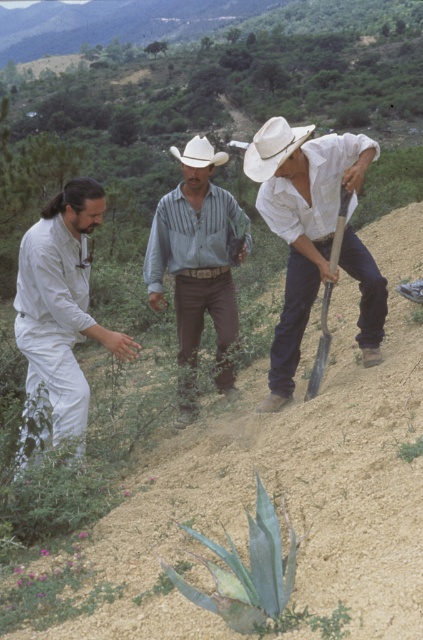
You are a photographer trying to capture a group photo of the striped cotton shirt at center and the white straw cowboy hat at center. Since you want to ensure both are clearly visible, which one should you focus on first to avoid blurriness if the subject moves?

The striped cotton shirt at center is shorter than the white straw cowboy hat at center, so you should focus on the white straw cowboy hat at center first because it is taller and might move more abruptly.

You are standing at the origin point in the image and want to move towards both the point at (x=184, y=282) and the point at (x=285, y=160). Which point will you reach first?

You will reach the point at (x=184, y=282) first because it is closer to you than the point at (x=285, y=160).

You are standing in the rural area depicted in the scene. There is a white matte shirt at center and a white felt cowboy hat at center. Which object is positioned more to the left?

The white felt cowboy hat at center is more to the left than the white matte shirt at center.